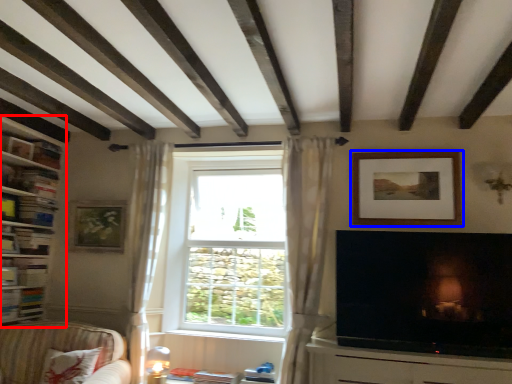
Question: Which of the following is the farthest to the observer, shelf (highlighted by a red box) or picture frame (highlighted by a blue box)?

Choices:
 (A) shelf
 (B) picture frame

Answer: (B)